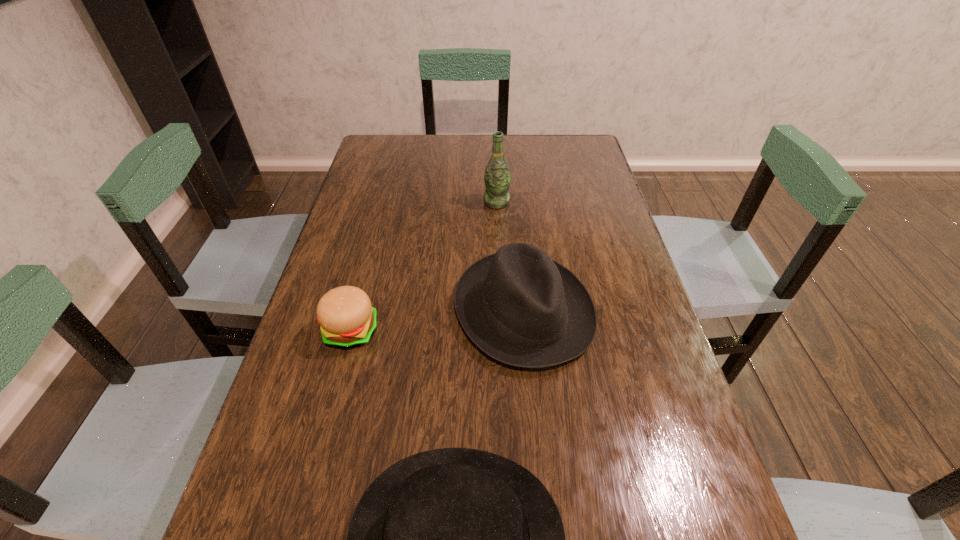
The width and height of the screenshot is (960, 540). Identify the location of vacant region at the left edge of the desktop. click(315, 530).

Locate an element on the screen. free region at the right edge is located at coordinates (582, 195).

The width and height of the screenshot is (960, 540). Identify the location of blank region between the leftmost object and the beer bottle. (424, 267).

At what (x,y) coordinates should I click in order to perform the action: click on vacant space that is in between the leftmost object and the tallest object. Please return your answer as a coordinate pair (x, y). Image resolution: width=960 pixels, height=540 pixels. Looking at the image, I should click on (424, 267).

In order to click on vacant space that is in between the farther fedora and the leftmost object in this screenshot , I will do `click(437, 321)`.

You are a GUI agent. You are given a task and a screenshot of the screen. Output one action in this format:
    pyautogui.click(x=<x>, y=<y>)
    Task: Click on the vacant area that lies between the farther fedora and the hamburger
    
    Given the screenshot: What is the action you would take?
    pyautogui.click(x=437, y=321)

You are a GUI agent. You are given a task and a screenshot of the screen. Output one action in this format:
    pyautogui.click(x=<x>, y=<y>)
    Task: Click on the object that is the second nearest to the farthest object
    This screenshot has width=960, height=540.
    Given the screenshot: What is the action you would take?
    pyautogui.click(x=347, y=319)

At what (x,y) coordinates should I click in order to perform the action: click on object that is the second closest one to the leftmost object. Please return your answer as a coordinate pair (x, y). The height and width of the screenshot is (540, 960). Looking at the image, I should click on (455, 539).